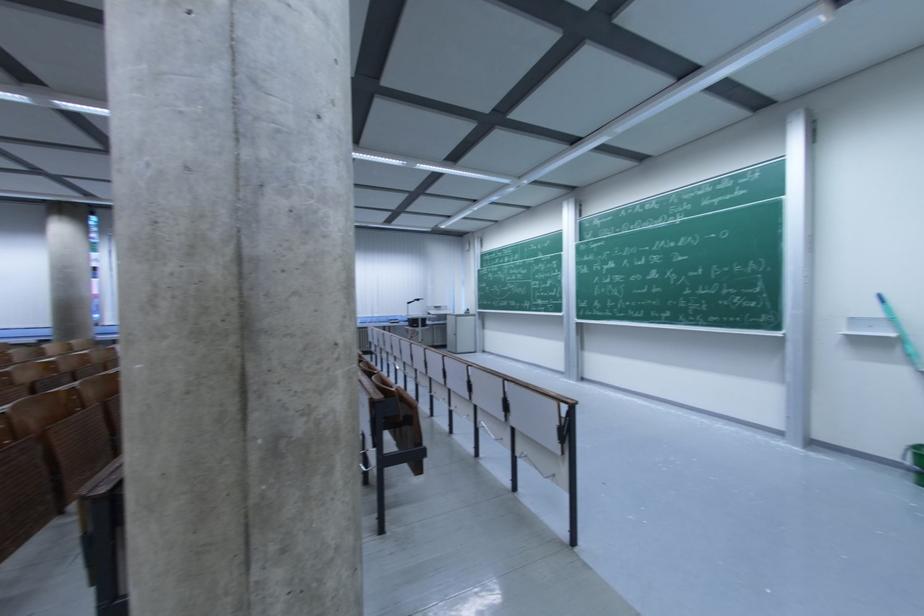
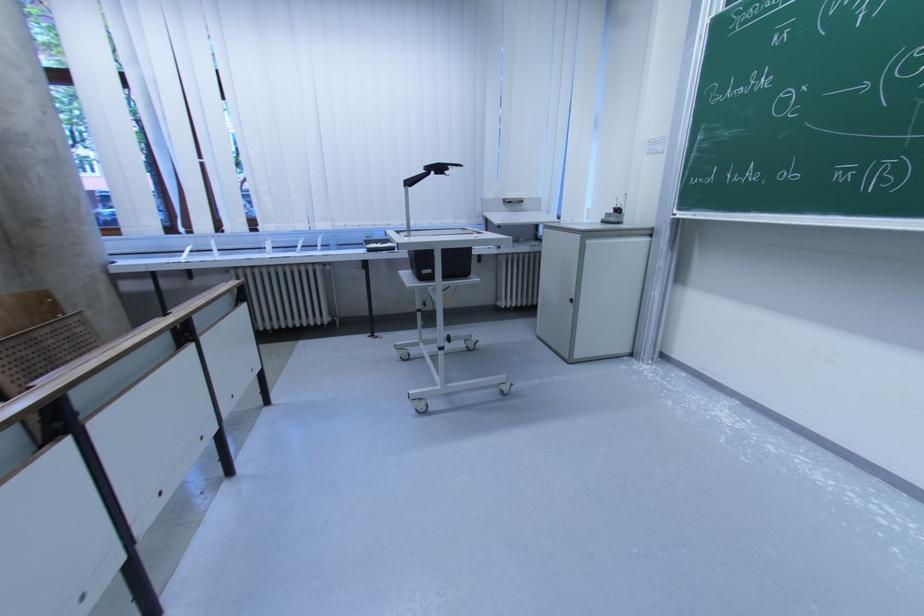
Where in the second image is the point corresponding to (422,302) from the first image?

(444, 171)